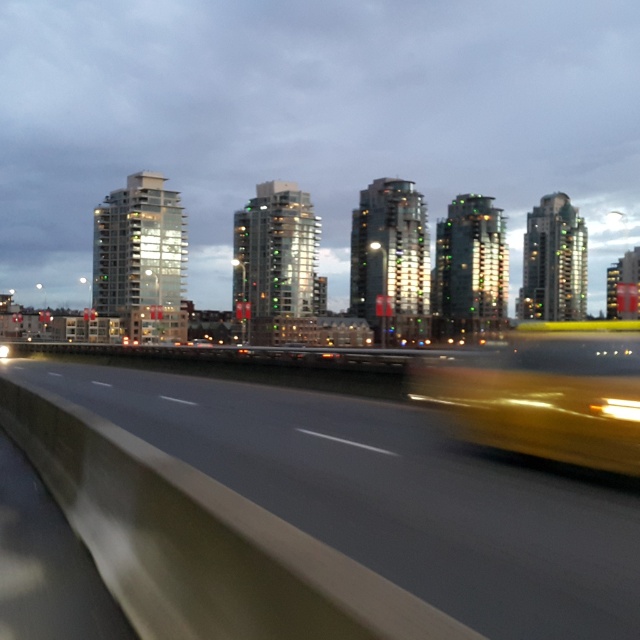
Which of these two, smooth asphalt highway at center or yellow rubber taxi at center, stands taller?

yellow rubber taxi at center

Can you confirm if smooth asphalt highway at center is thinner than yellow rubber taxi at center?

No.

Image resolution: width=640 pixels, height=640 pixels. What do you see at coordinates (396, 496) in the screenshot?
I see `smooth asphalt highway at center` at bounding box center [396, 496].

The height and width of the screenshot is (640, 640). I want to click on smooth asphalt highway at center, so click(x=396, y=496).